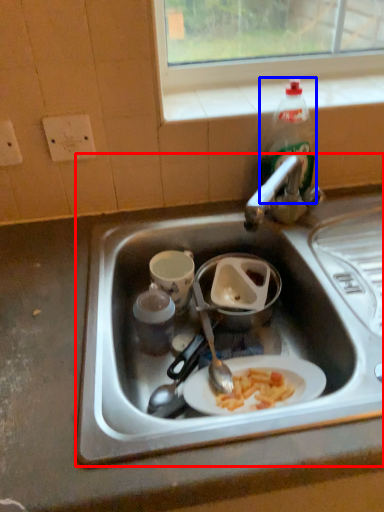
Question: Which object is further to the camera taking this photo, sink (highlighted by a red box) or bottle (highlighted by a blue box)?

Choices:
 (A) sink
 (B) bottle

Answer: (B)